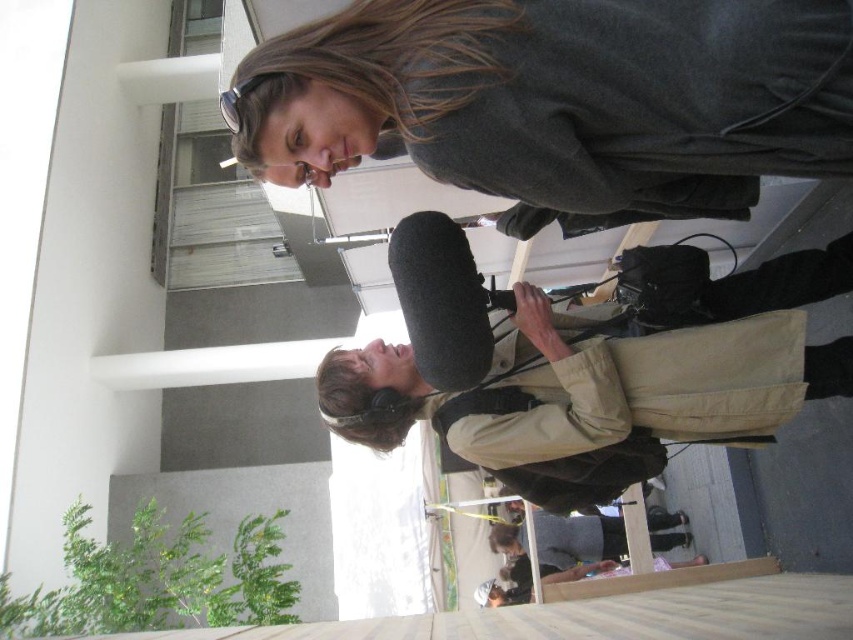
Question: Is dark gray sweater at upper center to the right of beige fabric backpack at center from the viewer's perspective?

Choices:
 (A) yes
 (B) no

Answer: (B)

Question: Is dark gray sweater at upper center bigger than beige fabric backpack at center?

Choices:
 (A) yes
 (B) no

Answer: (B)

Question: Which point appears farthest from the camera in this image?

Choices:
 (A) (540, 426)
 (B) (625, 1)

Answer: (A)

Question: Which point is closer to the camera?

Choices:
 (A) beige fabric backpack at center
 (B) dark gray sweater at upper center

Answer: (B)

Question: Can you confirm if dark gray sweater at upper center is positioned above beige fabric backpack at center?

Choices:
 (A) no
 (B) yes

Answer: (B)